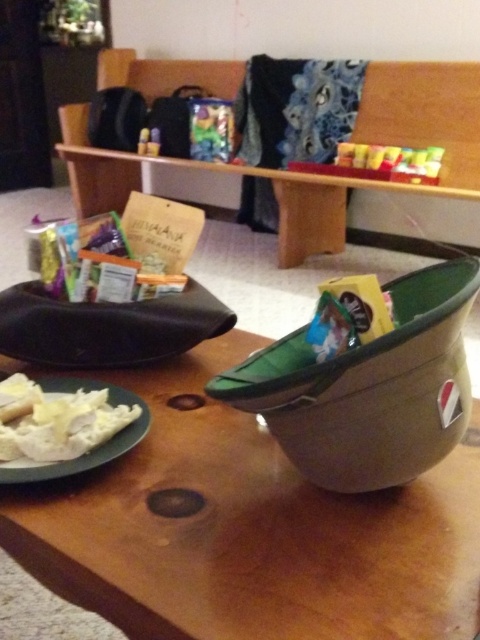
You are standing in the room and want to reach a point that is 32.26 inches away from you. Is the point at the center of the image or the point labeled as point (116, 320)?

The point labeled as point (116, 320) is 32.26 inches away from the camera, so it is the point you want to reach.

You are organizing items on a table and need to move the translucent plastic toy at center and the matte plastic bag at upper center. If you want to place them both on the shelf behind the table, which item should you move first to make space?

You should move the translucent plastic toy at center first because it is currently in front of the matte plastic bag at upper center. By moving the toy first, you can then access and move the bag more easily.

You are organizing items on a table and need to place a new item between the translucent plastic toy at center and the matte plastic bag at upper center. Based on their positions, where should you place the new item?

The new item should be placed above the translucent plastic toy at center since it is located below the matte plastic bag at upper center.